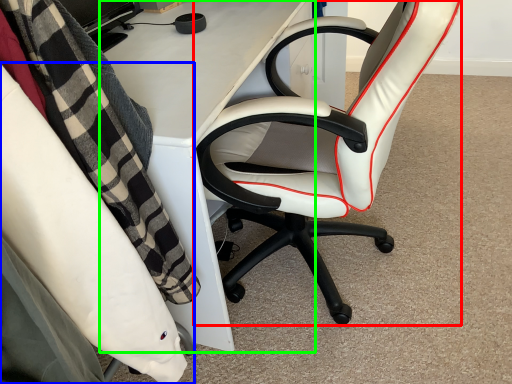
Question: Which object is the farthest from chair (highlighted by a red box)? Choose among these: chair (highlighted by a blue box) or desk (highlighted by a green box).

Choices:
 (A) chair
 (B) desk

Answer: (A)